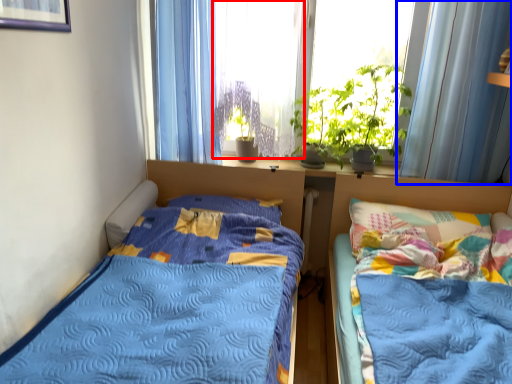
Question: Which point is further to the camera, window screen (highlighted by a red box) or curtain (highlighted by a blue box)?

Choices:
 (A) window screen
 (B) curtain

Answer: (A)